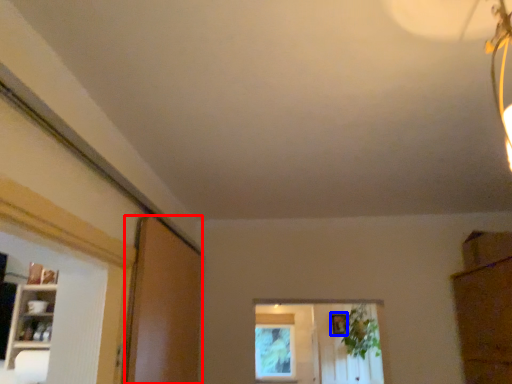
Question: Among these objects, which one is nearest to the camera, screen door (highlighted by a red box) or picture frame (highlighted by a blue box)?

Choices:
 (A) screen door
 (B) picture frame

Answer: (A)